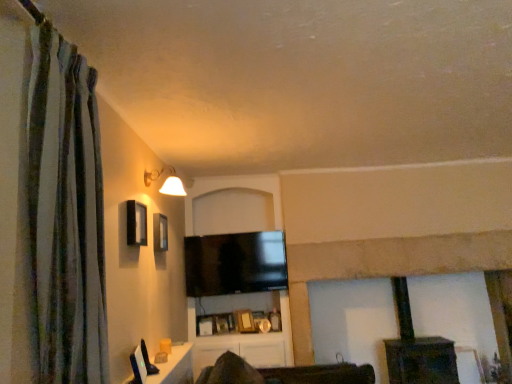
At what (x,y) coordinates should I click in order to perform the action: click on matte black window at upper left. Please return your answer as a coordinate pair (x, y). Image resolution: width=512 pixels, height=384 pixels. Looking at the image, I should click on (136, 223).

Describe the element at coordinates (136, 223) in the screenshot. I see `matte black window at upper left` at that location.

Based on the photo, measure the distance between point (61, 374) and camera.

Point (61, 374) is 4.35 feet away from camera.

You are a GUI agent. You are given a task and a screenshot of the screen. Output one action in this format:
    pyautogui.click(x=<x>, y=<y>)
    Task: Click on the white glossy table at lower left
    
    Given the screenshot: What is the action you would take?
    pyautogui.click(x=175, y=367)

What do you see at coordinates (234, 263) in the screenshot? I see `flat screen tv at center` at bounding box center [234, 263].

What are the coordinates of `dark brown wood fireplace at center` in the screenshot? It's located at (417, 349).

The image size is (512, 384). I want to click on matte black window at upper left, so click(x=136, y=223).

Considering the points (64, 354) and (253, 233), which point is behind, point (64, 354) or point (253, 233)?

The point (253, 233) is more distant.

From a real-world perspective, between green striped curtain at left and flat screen tv at center, who is vertically lower?

In real-world perspective, flat screen tv at center is lower.

Could you tell me if green striped curtain at left is turned towards flat screen tv at center?

No, green striped curtain at left does not turn towards flat screen tv at center.

From the image's perspective, which object appears higher, green striped curtain at left or flat screen tv at center?

green striped curtain at left, from the image's perspective.

Which object is positioned more to the right, flat screen tv at center or matte white lampshade at upper left?

flat screen tv at center.

Is flat screen tv at center facing away from matte white lampshade at upper left?

No, flat screen tv at center's orientation is not away from matte white lampshade at upper left.

From the image's perspective, which object appears higher, flat screen tv at center or matte white lampshade at upper left?

matte white lampshade at upper left appears higher in the image.

Image resolution: width=512 pixels, height=384 pixels. I want to click on light fixture on the left of flat screen tv at center, so click(x=166, y=181).

Is point (72, 64) positioned behind point (149, 377)?

No, (72, 64) is closer to viewer.

Is green striped curtain at left located outside white glossy table at lower left?

Yes, green striped curtain at left is located beyond the bounds of white glossy table at lower left.

Relative to white glossy table at lower left, is green striped curtain at left in front or behind?

In the image, green striped curtain at left appears in front of white glossy table at lower left.

From the image's perspective, who appears lower, green striped curtain at left or white glossy table at lower left?

From the image's view, white glossy table at lower left is below.

Image resolution: width=512 pixels, height=384 pixels. In order to click on light fixture in front of the flat screen tv at center in this screenshot , I will do `click(166, 181)`.

Considering the sizes of objects matte white lampshade at upper left and flat screen tv at center in the image provided, who is taller, matte white lampshade at upper left or flat screen tv at center?

flat screen tv at center.

From the image's perspective, does matte white lampshade at upper left appear lower than flat screen tv at center?

No, from the image's perspective, matte white lampshade at upper left is not beneath flat screen tv at center.

Who is smaller, matte white lampshade at upper left or flat screen tv at center?

matte white lampshade at upper left is smaller.

Which object is further away from the camera, flat screen tv at center or matte black window at upper left?

flat screen tv at center is more distant.

From a real-world perspective, which object stands above the other?

matte black window at upper left is physically above.

Would you say flat screen tv at center is to the left or to the right of matte black window at upper left in the picture?

From the image, it's evident that flat screen tv at center is to the right of matte black window at upper left.

From the image's perspective, does flat screen tv at center appear higher than matte black window at upper left?

No, from the image's perspective, flat screen tv at center is not on top of matte black window at upper left.

Can we say dark brown wood fireplace at center lies outside flat screen tv at center?

Yes, dark brown wood fireplace at center is outside of flat screen tv at center.

Is dark brown wood fireplace at center facing towards flat screen tv at center?

No, dark brown wood fireplace at center is not turned towards flat screen tv at center.

Is dark brown wood fireplace at center to the right of flat screen tv at center from the viewer's perspective?

Yes, dark brown wood fireplace at center is to the right of flat screen tv at center.

Considering the sizes of objects dark brown wood fireplace at center and flat screen tv at center in the image provided, who is taller, dark brown wood fireplace at center or flat screen tv at center?

dark brown wood fireplace at center is taller.

From the image's perspective, is matte black window at upper left located above green striped curtain at left?

No, from the image's perspective, matte black window at upper left is not on top of green striped curtain at left.

From a real-world perspective, is matte black window at upper left physically located above or below green striped curtain at left?

matte black window at upper left is situated higher than green striped curtain at left in the real world.

Can you confirm if matte black window at upper left is shorter than green striped curtain at left?

Correct, matte black window at upper left is not as tall as green striped curtain at left.

Where is `curtain located on the left of flat screen tv at center`? This screenshot has width=512, height=384. curtain located on the left of flat screen tv at center is located at coordinates (66, 214).

Where is `light fixture located above the flat screen tv at center (from a real-world perspective)`? Image resolution: width=512 pixels, height=384 pixels. light fixture located above the flat screen tv at center (from a real-world perspective) is located at coordinates (x=166, y=181).

When comparing their distances from flat screen tv at center, does green striped curtain at left or white glossy table at lower left seem closer?

white glossy table at lower left is positioned closer to the anchor flat screen tv at center.

Based on the photo, which object lies further to the anchor point white glossy table at lower left, flat screen tv at center or dark brown wood fireplace at center?

dark brown wood fireplace at center is further to white glossy table at lower left.

Considering their positions, is white glossy table at lower left positioned closer to dark brown wood fireplace at center than green striped curtain at left?

white glossy table at lower left lies closer to dark brown wood fireplace at center than the other object.

From the picture: Looking at the image, which one is located closer to matte black window at upper left, green striped curtain at left or flat screen tv at center?

The object closer to matte black window at upper left is green striped curtain at left.

Based on the photo, estimate the real-world distances between objects in this image. Which object is closer to matte black window at upper left, white glossy table at lower left or flat screen tv at center?

white glossy table at lower left is positioned closer to the anchor matte black window at upper left.

Looking at the image, which one is located closer to dark brown wood fireplace at center, matte black window at upper left or flat screen tv at center?

Based on the image, flat screen tv at center appears to be nearer to dark brown wood fireplace at center.

Considering their positions, is white glossy table at lower left positioned further to matte white lampshade at upper left than dark brown wood fireplace at center?

dark brown wood fireplace at center is positioned further to the anchor matte white lampshade at upper left.

Looking at the image, which one is located further to flat screen tv at center, matte black window at upper left or green striped curtain at left?

green striped curtain at left is positioned further to the anchor flat screen tv at center.

I want to click on table between matte black window at upper left and dark brown wood fireplace at center, so click(175, 367).

Identify the location of table located between green striped curtain at left and flat screen tv at center in the depth direction. Image resolution: width=512 pixels, height=384 pixels. tap(175, 367).

Where is `table located between green striped curtain at left and dark brown wood fireplace at center in the depth direction`? Image resolution: width=512 pixels, height=384 pixels. table located between green striped curtain at left and dark brown wood fireplace at center in the depth direction is located at coordinates (175, 367).

You are a GUI agent. You are given a task and a screenshot of the screen. Output one action in this format:
    pyautogui.click(x=<x>, y=<y>)
    Task: Click on the television situated between matte white lampshade at upper left and dark brown wood fireplace at center from left to right
    The image size is (512, 384).
    Given the screenshot: What is the action you would take?
    pyautogui.click(x=234, y=263)